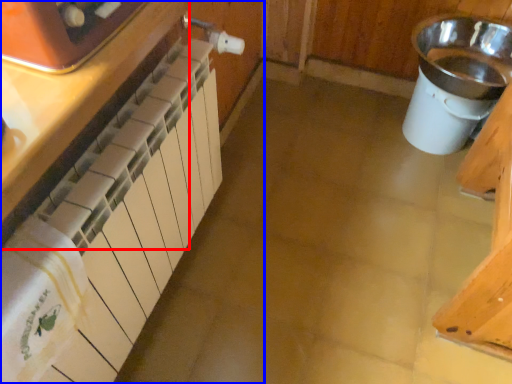
Question: Which of the following is the closest to the observer, cabinetry (highlighted by a red box) or cabinetry (highlighted by a blue box)?

Choices:
 (A) cabinetry
 (B) cabinetry

Answer: (A)